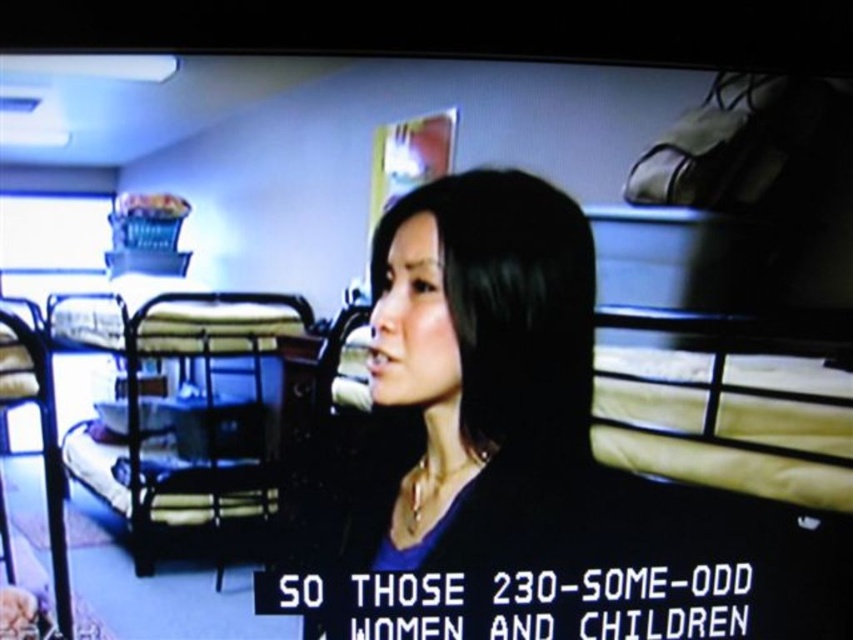
Between point (427, 269) and point (233, 545), which one is positioned behind?

Positioned behind is point (233, 545).

Who is positioned more to the right, black matte hair at center or metallic silver bunk bed at left?

From the viewer's perspective, black matte hair at center appears more on the right side.

Find the location of a particular element. The height and width of the screenshot is (640, 853). black matte hair at center is located at coordinates (471, 380).